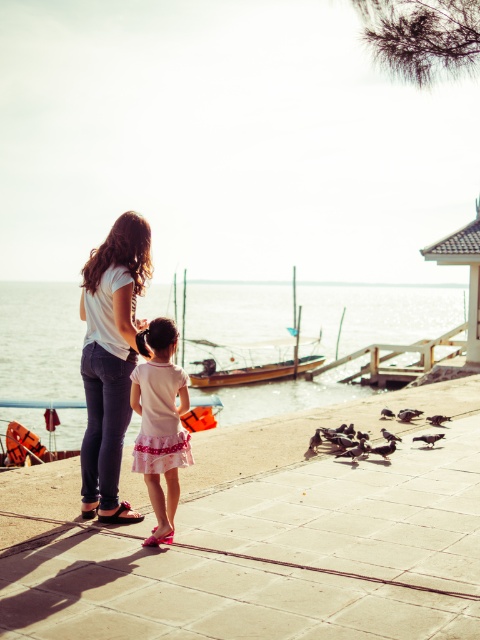
You are a photographer trying to capture a closeup of the pink fabric sandal at lower center without including the matte white shirt at center in the frame. Is this possible given their positions?

The matte white shirt at center is further to the viewer than the pink fabric sandal at lower center, so if you move the camera closer to the pink fabric sandal at lower center and adjust the angle to exclude the matte white shirt at center, it might be possible to capture the closeup without including it.